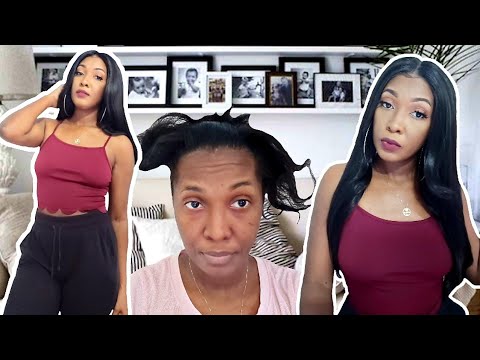
Image resolution: width=480 pixels, height=360 pixels. What are the coordinates of `photos` in the screenshot? It's located at (53, 66), (141, 77), (189, 75), (222, 85), (255, 81), (281, 91), (304, 72), (338, 94), (368, 66).